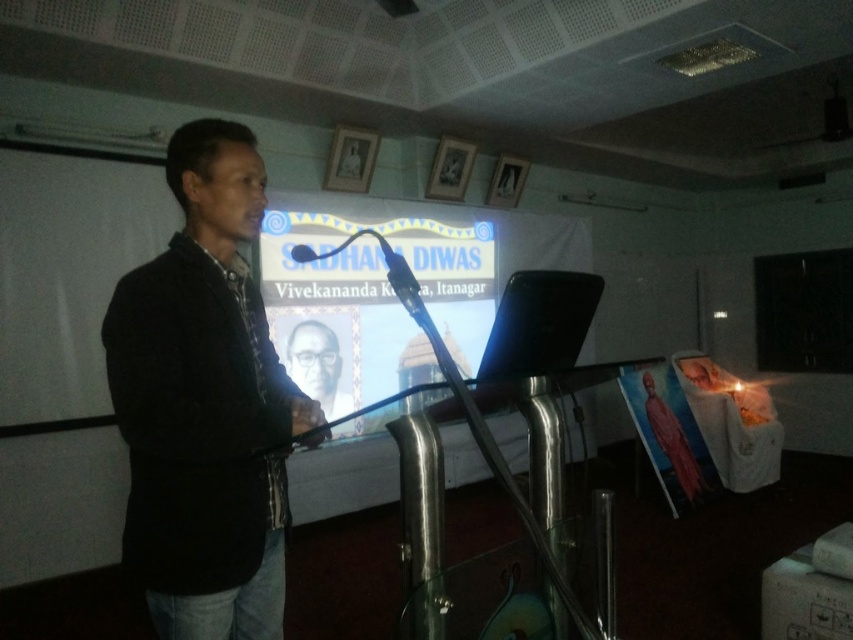
Is black matte jacket at left thinner than matte black portrait at center?

No.

Does black matte jacket at left appear on the left side of matte black portrait at center?

Incorrect, black matte jacket at left is not on the left side of matte black portrait at center.

Where is `black matte jacket at left`? black matte jacket at left is located at coordinates tap(204, 403).

At what (x,y) coordinates should I click in order to perform the action: click on black matte jacket at left. Please return your answer as a coordinate pair (x, y). The width and height of the screenshot is (853, 640). Looking at the image, I should click on (204, 403).

In the scene shown: Between matte black screen at center and matte black portrait at center, which one has more height?

matte black screen at center is taller.

Identify the location of matte black screen at center. (392, 289).

The image size is (853, 640). What are the coordinates of `matte black screen at center` in the screenshot? It's located at (392, 289).

Can you confirm if matte black screen at center is wider than matte black microphone at center?

Yes.

Measure the distance between point (486, 280) and camera.

A distance of 16.52 feet exists between point (486, 280) and camera.

Is point (386, 218) in front of point (312, 253)?

No, (386, 218) is further to viewer.

This screenshot has width=853, height=640. I want to click on matte black screen at center, so click(x=392, y=289).